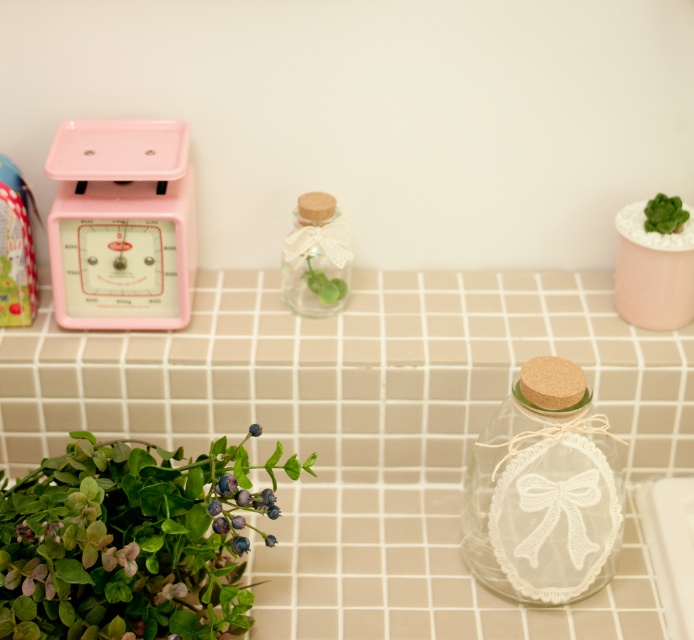
Can you confirm if white grid tile counter at center is positioned below transparent glass jar with lace bow at center?

Incorrect, white grid tile counter at center is not positioned below transparent glass jar with lace bow at center.

Is the position of white grid tile counter at center less distant than that of transparent glass jar with lace bow at center?

No, it is not.

Which is in front, point (393, 323) or point (564, 476)?

Point (564, 476) is more forward.

Identify the location of white grid tile counter at center. The height and width of the screenshot is (640, 694). (366, 429).

Between point (282, 253) and point (645, 230), which one is positioned behind?

Positioned behind is point (282, 253).

From the picture: Does clear glass bottle at center have a lesser height compared to green leafy plant at upper right?

No, clear glass bottle at center is not shorter than green leafy plant at upper right.

Between point (323, 243) and point (661, 228), which one is positioned behind?

The point (323, 243) is behind.

I want to click on clear glass bottle at center, so click(314, 257).

What do you see at coordinates (366, 429) in the screenshot? This screenshot has height=640, width=694. I see `white grid tile counter at center` at bounding box center [366, 429].

Which of these two, white grid tile counter at center or matte pink scale at left, stands taller?

white grid tile counter at center is taller.

Who is more distant from viewer, (x=514, y=352) or (x=178, y=172)?

The point (x=514, y=352) is more distant.

You are a GUI agent. You are given a task and a screenshot of the screen. Output one action in this format:
    pyautogui.click(x=<x>, y=<y>)
    Task: Click on the white grid tile counter at center
    The width and height of the screenshot is (694, 640).
    Given the screenshot: What is the action you would take?
    pyautogui.click(x=366, y=429)